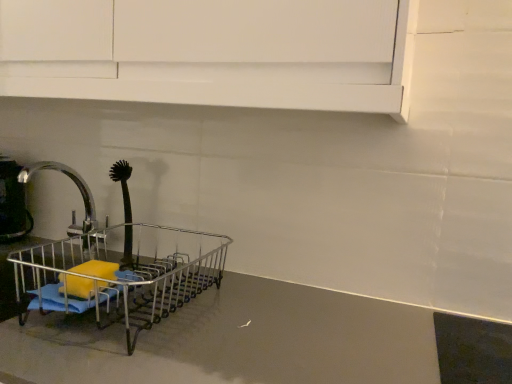
This screenshot has width=512, height=384. What are the coordinates of `vacant region above metallic gray counter top at center (from a real-world perspective)` in the screenshot? It's located at (202, 331).